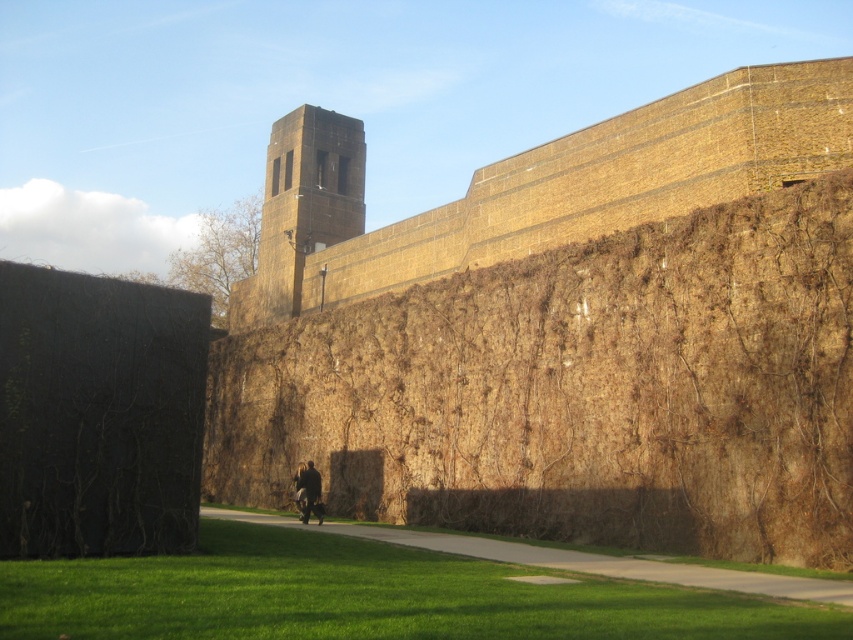
You are a gardener who needs to trim the black textured hedge at left and place the dark brown leather jacket at center on a bench. Which object requires more horizontal space to work around?

The black textured hedge at left requires more horizontal space to work around since its width is larger than the dark brown leather jacket at center.

You are standing in front of the brick wall and want to place a small potted plant exactly at the position of the black textured hedge at left. What are the coordinates where you should place the plant?

The coordinates for the black textured hedge at left are at point (97, 413), so you should place the potted plant there.

You are standing in front of the brick wall and see a point marked at coordinates (x=364, y=596). What is located at this point?

The point at coordinates (x=364, y=596) indicates green grass at lower center.